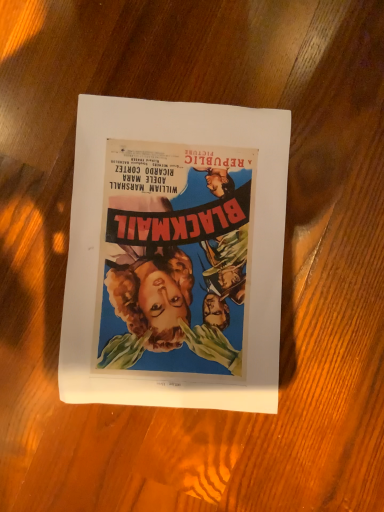
The width and height of the screenshot is (384, 512). Describe the element at coordinates (175, 255) in the screenshot. I see `vibrant paper poster at center` at that location.

Find the location of `vibrant paper poster at center`. vibrant paper poster at center is located at coordinates (175, 255).

Measure the distance between vibrant paper poster at center and camera.

The depth of vibrant paper poster at center is 15.83 inches.

Locate an element on the screen. The height and width of the screenshot is (512, 384). vibrant paper poster at center is located at coordinates (175, 255).